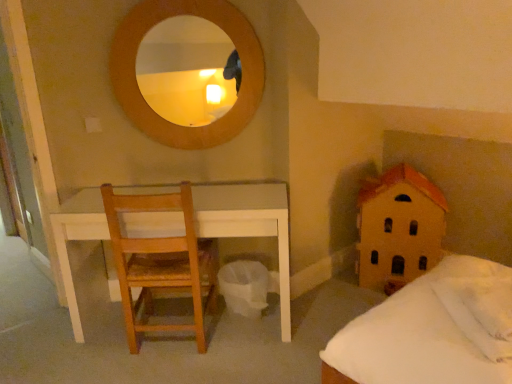
Question: Visually, is light brown wooden chair at left positioned to the left or to the right of white soft pillow at lower right, which is counted as the 1th pillow, starting from the front?

Choices:
 (A) right
 (B) left

Answer: (B)

Question: Based on their sizes in the image, would you say light brown wooden chair at left is bigger or smaller than white soft pillow at lower right, which is counted as the 1th pillow, starting from the front?

Choices:
 (A) big
 (B) small

Answer: (A)

Question: Considering the real-world distances, which object is farthest from the white fluffy pillow at lower right, which ranks as the 2th pillow in front-to-back order?

Choices:
 (A) wooden house at right
 (B) white soft pillow at lower right, which ranks as the second pillow in back-to-front order
 (C) light brown wooden chair at left

Answer: (C)

Question: Based on their relative distances, which object is nearer to the white fluffy pillow at lower right, which ranks as the 2th pillow in front-to-back order?

Choices:
 (A) light brown wooden chair at left
 (B) white soft pillow at lower right, which is counted as the 1th pillow, starting from the front
 (C) wooden house at right

Answer: (B)